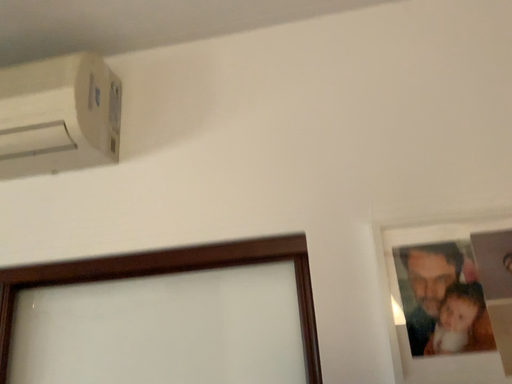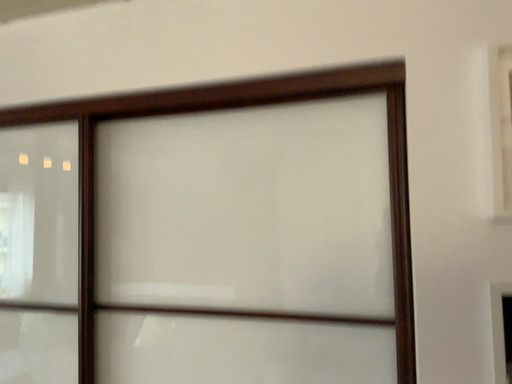
Question: How did the camera likely rotate when shooting the video?

Choices:
 (A) rotated left
 (B) rotated right

Answer: (A)